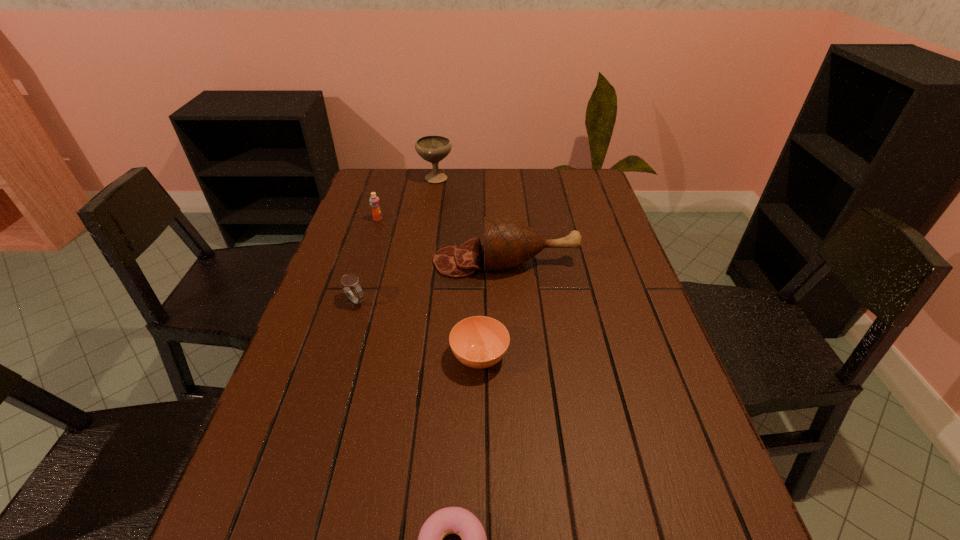
The width and height of the screenshot is (960, 540). In order to click on the farthest object in this screenshot , I will do `click(433, 148)`.

You are a GUI agent. You are given a task and a screenshot of the screen. Output one action in this format:
    pyautogui.click(x=<x>, y=<y>)
    Task: Click on the ham
    The height and width of the screenshot is (540, 960).
    Given the screenshot: What is the action you would take?
    pyautogui.click(x=508, y=243)

Locate an element on the screen. the third tallest object is located at coordinates (374, 201).

This screenshot has width=960, height=540. I want to click on orange juice, so 374,201.

At what (x,y) coordinates should I click in order to perform the action: click on watch. Please return your answer as a coordinate pair (x, y). This screenshot has width=960, height=540. Looking at the image, I should click on (347, 280).

Find the location of a particular element. Image resolution: width=960 pixels, height=540 pixels. the fifth farthest object is located at coordinates (479, 342).

The image size is (960, 540). I want to click on free space located 0.230m on the right of the farthest object, so click(x=515, y=178).

The image size is (960, 540). In order to click on vacant space located 0.090m at the sliced end of the ham in this screenshot , I will do `click(402, 261)`.

Find the location of a particular element. The height and width of the screenshot is (540, 960). free point located at the sliced end of the ham is located at coordinates (385, 261).

Locate an element on the screen. vacant region located at the sliced end of the ham is located at coordinates pos(330,261).